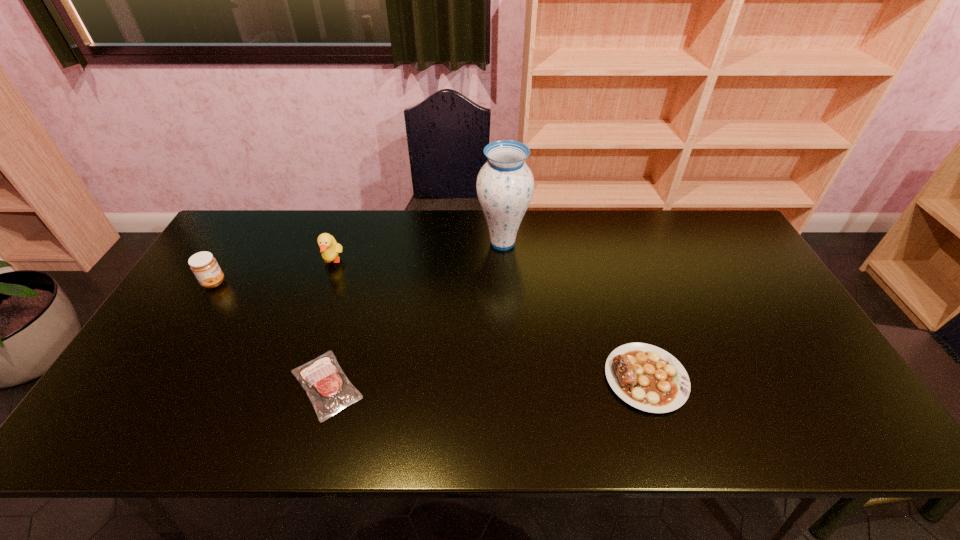
What are the coordinates of `blank space located 0.060m on the front-facing side of the duckling` in the screenshot? It's located at (324, 286).

Image resolution: width=960 pixels, height=540 pixels. Identify the location of vacant space located on the front label of the leftmost object. (242, 282).

This screenshot has height=540, width=960. I want to click on free space located 0.200m on the right of the fourth tallest object, so click(x=768, y=378).

Image resolution: width=960 pixels, height=540 pixels. What are the coordinates of `vacant space situated 0.150m on the right of the left steak` in the screenshot? It's located at (428, 384).

Locate an element on the screen. This screenshot has width=960, height=540. vase at the far edge is located at coordinates (505, 184).

Identify the location of duckling at the far edge. This screenshot has width=960, height=540. (329, 248).

This screenshot has height=540, width=960. Identify the location of object that is positioned at the left edge. (204, 266).

I want to click on blank space at the far edge of the desktop, so click(x=322, y=215).

You are a GUI agent. You are given a task and a screenshot of the screen. Output one action in this format:
    pyautogui.click(x=<x>, y=<y>)
    Task: Click on the vacant area at the near edge
    Image resolution: width=960 pixels, height=540 pixels.
    Given the screenshot: What is the action you would take?
    pyautogui.click(x=779, y=435)

In order to click on free region at the left edge of the desktop in this screenshot , I will do `click(230, 295)`.